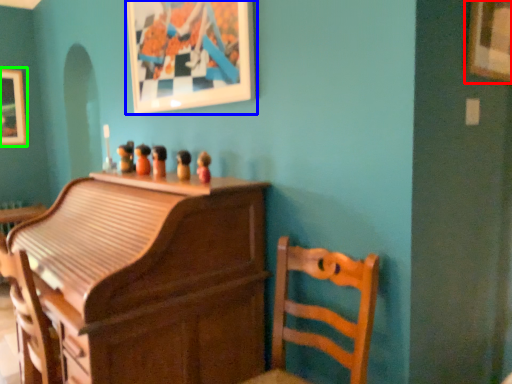
Question: Which is nearer to the picture frame (highlighted by a red box)? picture frame (highlighted by a blue box) or picture frame (highlighted by a green box).

Choices:
 (A) picture frame
 (B) picture frame

Answer: (A)